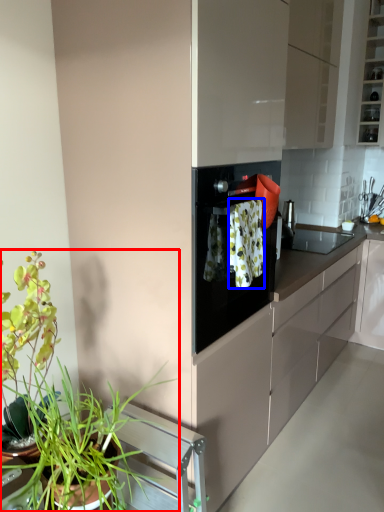
Question: Which point is further to the camera, houseplant (highlighted by a red box) or laundry (highlighted by a blue box)?

Choices:
 (A) houseplant
 (B) laundry

Answer: (B)